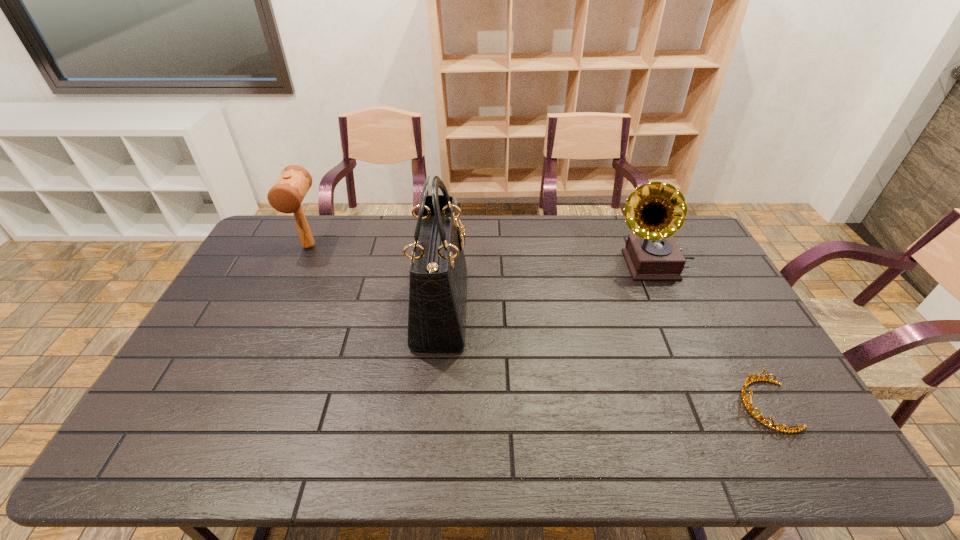
Find the location of a particular element. Image resolution: width=960 pixels, height=540 pixels. free space located 0.220m on the strike surface of the leftmost object is located at coordinates (281, 306).

The height and width of the screenshot is (540, 960). In order to click on vacant point located 0.240m on the front-facing side of the shortest object in this screenshot , I will do `click(647, 405)`.

At what (x,y) coordinates should I click in order to perform the action: click on free space located on the front-facing side of the shortest object. Please return your answer as a coordinate pair (x, y). The width and height of the screenshot is (960, 540). Looking at the image, I should click on (706, 405).

Image resolution: width=960 pixels, height=540 pixels. Identify the location of vacant region located on the front-facing side of the shortest object. (589, 405).

In order to click on phonograph record that is positioned at the far edge in this screenshot , I will do `click(655, 211)`.

At what (x,y) coordinates should I click in order to perform the action: click on mallet at the far edge. Please return your answer as a coordinate pair (x, y). This screenshot has height=540, width=960. Looking at the image, I should click on (286, 195).

At what (x,y) coordinates should I click in order to perform the action: click on object positioned at the near edge. Please return your answer as a coordinate pair (x, y). The image size is (960, 540). Looking at the image, I should click on (748, 381).

I want to click on object that is at the left edge, so click(x=286, y=195).

The image size is (960, 540). Find the location of `phonograph record that is at the right edge`. phonograph record that is at the right edge is located at coordinates (655, 211).

This screenshot has width=960, height=540. Identify the location of tiara at the right edge. (748, 381).